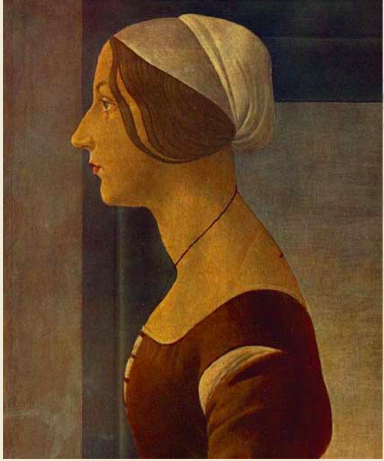
Identify the location of grey wall. This screenshot has height=461, width=384. (52, 90).